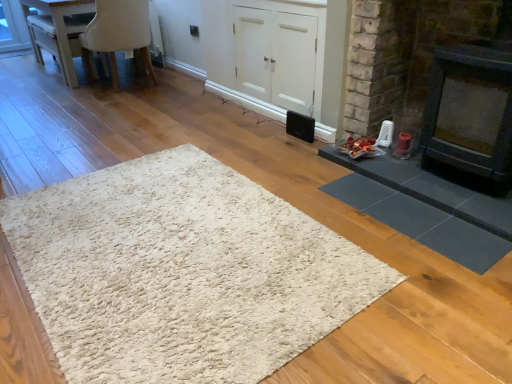
Where is `beige fabric chair at upper left`? beige fabric chair at upper left is located at coordinates (118, 33).

In order to click on black matte fireplace at right, the first fireplace when ordered from right to left in this screenshot , I will do `click(470, 114)`.

Locate an element on the screen. dark gray stone fireplace at right, which appears as the 1th fireplace when viewed from the left is located at coordinates (404, 56).

Identify the location of black matte speaker at center. (300, 126).

Locate an element on the screen. The image size is (512, 384). beige fabric chair at upper left is located at coordinates (118, 33).

In the scene shown: Which is nearer, [75,2] or [136,8]?

The point [136,8] is in front.

Is white glossy table at upper left bigger than beige fabric chair at upper left?

No.

Considering the sizes of white glossy table at upper left and beige fabric chair at upper left in the image, is white glossy table at upper left wider or thinner than beige fabric chair at upper left?

Considering their sizes, white glossy table at upper left looks slimmer than beige fabric chair at upper left.

Where is `chair in front of the white glossy table at upper left`? chair in front of the white glossy table at upper left is located at coordinates (118, 33).

From a real-world perspective, is dark gray stone fireplace at right, which appears as the 2th fireplace when viewed from the right, physically below white shaggy rug at center, positioned as the 2th mat in right-to-left order?

No, from a real-world perspective, dark gray stone fireplace at right, which appears as the 2th fireplace when viewed from the right, is not below white shaggy rug at center, positioned as the 2th mat in right-to-left order.

Considering the relative positions of dark gray stone fireplace at right, which appears as the 1th fireplace when viewed from the left, and white shaggy rug at center, the 1th mat when ordered from left to right, in the image provided, is dark gray stone fireplace at right, which appears as the 1th fireplace when viewed from the left, behind white shaggy rug at center, the 1th mat when ordered from left to right,?

Yes, dark gray stone fireplace at right, which appears as the 1th fireplace when viewed from the left, is further from the viewer.

From the image's perspective, between dark gray stone fireplace at right, which appears as the 1th fireplace when viewed from the left, and white shaggy rug at center, positioned as the 2th mat in right-to-left order, which one is located above?

From the image's view, dark gray stone fireplace at right, which appears as the 1th fireplace when viewed from the left, is above.

The width and height of the screenshot is (512, 384). What are the coordinates of `the 2nd mat below when counting from the dark gray stone fireplace at right, which appears as the 1th fireplace when viewed from the left (from the image's perspective)` in the screenshot? It's located at (182, 272).

From a real-world perspective, is white shaggy rug at center, positioned as the 2th mat in right-to-left order, beneath dark gray rubber mat at lower right, arranged as the 2th mat when viewed from the left?

Correct, in the physical world, white shaggy rug at center, positioned as the 2th mat in right-to-left order, is lower than dark gray rubber mat at lower right, arranged as the 2th mat when viewed from the left.

Which of these two, white shaggy rug at center, the 1th mat when ordered from left to right, or dark gray rubber mat at lower right, which is the 1th mat in right-to-left order, stands taller?

With more height is white shaggy rug at center, the 1th mat when ordered from left to right.

Does point (165, 190) come closer to viewer compared to point (458, 227)?

No, it is behind (458, 227).

How many degrees apart are the facing directions of beige fabric chair at upper left and white shaggy rug at center, the 1th mat when ordered from left to right?

The angle between the facing direction of beige fabric chair at upper left and the facing direction of white shaggy rug at center, the 1th mat when ordered from left to right, is 92.4 degrees.

In the scene shown: Does beige fabric chair at upper left have a smaller size compared to white shaggy rug at center, the 1th mat when ordered from left to right?

No, beige fabric chair at upper left is not smaller than white shaggy rug at center, the 1th mat when ordered from left to right.

From the image's perspective, which object appears higher, beige fabric chair at upper left or white shaggy rug at center, the 1th mat when ordered from left to right?

beige fabric chair at upper left is shown above in the image.

Is beige fabric chair at upper left outside of white shaggy rug at center, positioned as the 2th mat in right-to-left order?

Yes, beige fabric chair at upper left is outside of white shaggy rug at center, positioned as the 2th mat in right-to-left order.

Which is behind, black matte fireplace at right, the first fireplace when ordered from right to left, or dark gray rubber mat at lower right, which is the 1th mat in right-to-left order?

dark gray rubber mat at lower right, which is the 1th mat in right-to-left order, is further from the camera.

Is black matte fireplace at right, the second fireplace positioned from the left, surrounding dark gray rubber mat at lower right, arranged as the 2th mat when viewed from the left?

No, dark gray rubber mat at lower right, arranged as the 2th mat when viewed from the left, is not surrounded by black matte fireplace at right, the second fireplace positioned from the left.

Which of these two, black matte fireplace at right, the second fireplace positioned from the left, or dark gray rubber mat at lower right, which is the 1th mat in right-to-left order, stands taller?

With more height is black matte fireplace at right, the second fireplace positioned from the left.

In the scene shown: Which object is thinner, black matte fireplace at right, the second fireplace positioned from the left, or dark gray rubber mat at lower right, which is the 1th mat in right-to-left order?

With smaller width is dark gray rubber mat at lower right, which is the 1th mat in right-to-left order.

Which point is more forward, (383, 66) or (303, 139)?

The point (383, 66) is closer.

Is dark gray stone fireplace at right, which appears as the 1th fireplace when viewed from the left, oriented away from black matte speaker at center?

No, dark gray stone fireplace at right, which appears as the 1th fireplace when viewed from the left, is not facing away from black matte speaker at center.

Does dark gray stone fireplace at right, which appears as the 1th fireplace when viewed from the left, have a lesser width compared to black matte speaker at center?

No.

Can you confirm if dark gray stone fireplace at right, which appears as the 1th fireplace when viewed from the left, is smaller than black matte speaker at center?

Incorrect, dark gray stone fireplace at right, which appears as the 1th fireplace when viewed from the left, is not smaller in size than black matte speaker at center.

How many degrees apart are the facing directions of dark gray rubber mat at lower right, arranged as the 2th mat when viewed from the left, and dark gray stone fireplace at right, which appears as the 2th fireplace when viewed from the right?

The angle between the facing direction of dark gray rubber mat at lower right, arranged as the 2th mat when viewed from the left, and the facing direction of dark gray stone fireplace at right, which appears as the 2th fireplace when viewed from the right, is 0.691 degrees.

Which object is positioned more to the left, dark gray rubber mat at lower right, which is the 1th mat in right-to-left order, or dark gray stone fireplace at right, which appears as the 2th fireplace when viewed from the right?

From the viewer's perspective, dark gray rubber mat at lower right, which is the 1th mat in right-to-left order, appears more on the left side.

Which object is further away from the camera taking this photo, dark gray rubber mat at lower right, arranged as the 2th mat when viewed from the left, or dark gray stone fireplace at right, which appears as the 2th fireplace when viewed from the right?

Positioned behind is dark gray rubber mat at lower right, arranged as the 2th mat when viewed from the left.

Is dark gray rubber mat at lower right, arranged as the 2th mat when viewed from the left, positioned beyond the bounds of dark gray stone fireplace at right, which appears as the 1th fireplace when viewed from the left?

dark gray rubber mat at lower right, arranged as the 2th mat when viewed from the left, is positioned outside dark gray stone fireplace at right, which appears as the 1th fireplace when viewed from the left.

The width and height of the screenshot is (512, 384). Identify the location of chair located above the white glossy table at upper left (from a real-world perspective). (118, 33).

The height and width of the screenshot is (384, 512). I want to click on the 1st fireplace behind the white shaggy rug at center, the 1th mat when ordered from left to right, starting your count from the anchor, so click(404, 56).

Considering their positions, is white shaggy rug at center, the 1th mat when ordered from left to right, positioned further to black matte fireplace at right, the first fireplace when ordered from right to left, than dark gray stone fireplace at right, which appears as the 1th fireplace when viewed from the left?

Based on the image, white shaggy rug at center, the 1th mat when ordered from left to right, appears to be further to black matte fireplace at right, the first fireplace when ordered from right to left.

Looking at the image, which one is located closer to white shaggy rug at center, positioned as the 2th mat in right-to-left order, white glossy table at upper left or beige fabric chair at upper left?

beige fabric chair at upper left is closer to white shaggy rug at center, positioned as the 2th mat in right-to-left order.

Considering their positions, is white glossy table at upper left positioned closer to beige fabric chair at upper left than dark gray stone fireplace at right, which appears as the 2th fireplace when viewed from the right?

white glossy table at upper left is closer to beige fabric chair at upper left.

Based on the photo, when comparing their distances from black matte speaker at center, does white shaggy rug at center, the 1th mat when ordered from left to right, or beige fabric chair at upper left seem further?

beige fabric chair at upper left.

Looking at the image, which one is located closer to black matte speaker at center, dark gray rubber mat at lower right, which is the 1th mat in right-to-left order, or black matte fireplace at right, the second fireplace positioned from the left?

Based on the image, black matte fireplace at right, the second fireplace positioned from the left, appears to be nearer to black matte speaker at center.

Consider the image. Estimate the real-world distances between objects in this image. Which object is further from black matte speaker at center, dark gray stone fireplace at right, which appears as the 1th fireplace when viewed from the left, or white shaggy rug at center, the 1th mat when ordered from left to right?

white shaggy rug at center, the 1th mat when ordered from left to right, is positioned further to the anchor black matte speaker at center.

Looking at the image, which one is located further to dark gray stone fireplace at right, which appears as the 2th fireplace when viewed from the right, white glossy table at upper left or dark gray rubber mat at lower right, which is the 1th mat in right-to-left order?

white glossy table at upper left is positioned further to the anchor dark gray stone fireplace at right, which appears as the 2th fireplace when viewed from the right.

Consider the image. From the image, which object appears to be nearer to black matte speaker at center, white shaggy rug at center, positioned as the 2th mat in right-to-left order, or dark gray stone fireplace at right, which appears as the 2th fireplace when viewed from the right?

dark gray stone fireplace at right, which appears as the 2th fireplace when viewed from the right.

The image size is (512, 384). In order to click on speaker between beige fabric chair at upper left and dark gray rubber mat at lower right, which is the 1th mat in right-to-left order, from left to right in this screenshot , I will do `click(300, 126)`.

Locate an element on the screen. The width and height of the screenshot is (512, 384). speaker between white glossy table at upper left and dark gray rubber mat at lower right, arranged as the 2th mat when viewed from the left is located at coordinates (300, 126).

Find the location of a particular element. mat located between dark gray stone fireplace at right, which appears as the 1th fireplace when viewed from the left, and black matte speaker at center in the depth direction is located at coordinates point(421,222).

This screenshot has height=384, width=512. What are the coordinates of `speaker between white glossy table at upper left and black matte fireplace at right, the first fireplace when ordered from right to left, in the horizontal direction` in the screenshot? It's located at (300, 126).